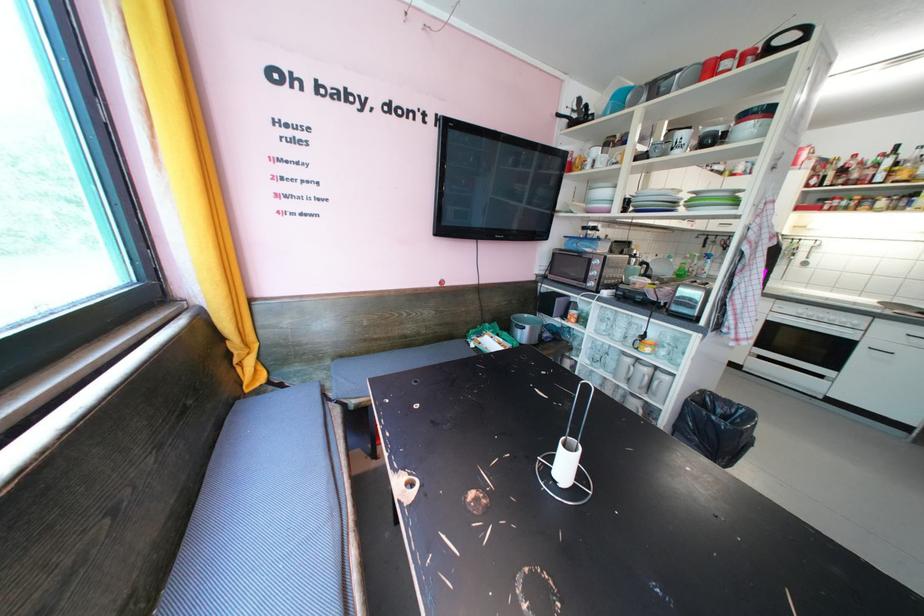
At what (x,y) coordinates should I click in order to perform the action: click on the top microwave oven knob. Please return your answer as a coordinate pair (x, y). Looking at the image, I should click on (596, 261).